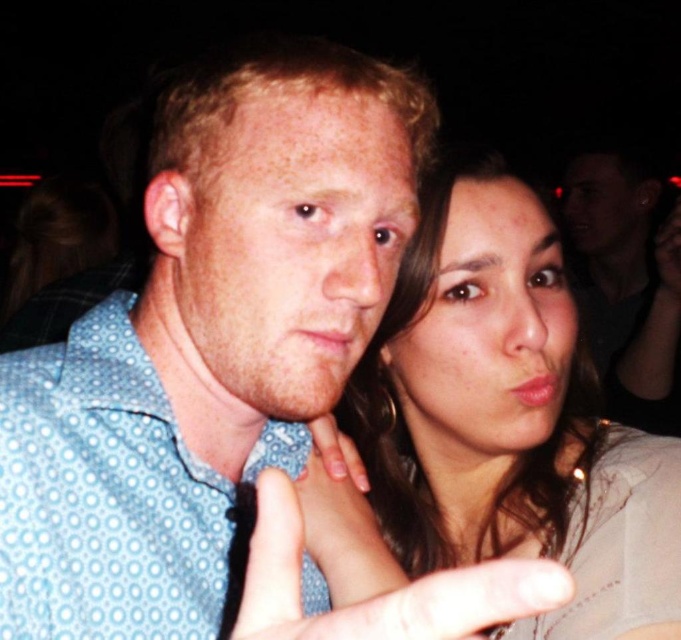
Which is behind, point (395, 392) or point (629, 340)?

The point (629, 340) is more distant.

Between matte gray shirt at center and matte black shirt at upper right, which one has less height?

matte gray shirt at center

Is point (454, 182) positioned in front of point (618, 209)?

Yes, it is in front of point (618, 209).

This screenshot has height=640, width=681. Identify the location of matte gray shirt at center. (492, 426).

Is point (511, 269) positioned before point (285, 488)?

No.

Locate an element on the screen. This screenshot has height=640, width=681. matte gray shirt at center is located at coordinates (492, 426).

Locate an element on the screen. The height and width of the screenshot is (640, 681). matte gray shirt at center is located at coordinates (492, 426).

Based on the photo, who is lower down, matte black shirt at upper right or white matte finger at center?

white matte finger at center is below.

The image size is (681, 640). What do you see at coordinates (624, 280) in the screenshot?
I see `matte black shirt at upper right` at bounding box center [624, 280].

Image resolution: width=681 pixels, height=640 pixels. I want to click on matte black shirt at upper right, so click(624, 280).